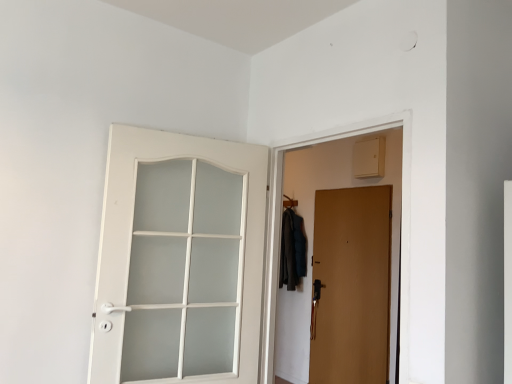
Describe the element at coordinates (179, 260) in the screenshot. I see `white matte door at left` at that location.

I want to click on white matte door at left, so click(x=179, y=260).

At what (x,y) coordinates should I click in order to perform the action: click on white matte door at left. Please return your answer as a coordinate pair (x, y). The width and height of the screenshot is (512, 384). Looking at the image, I should click on (179, 260).